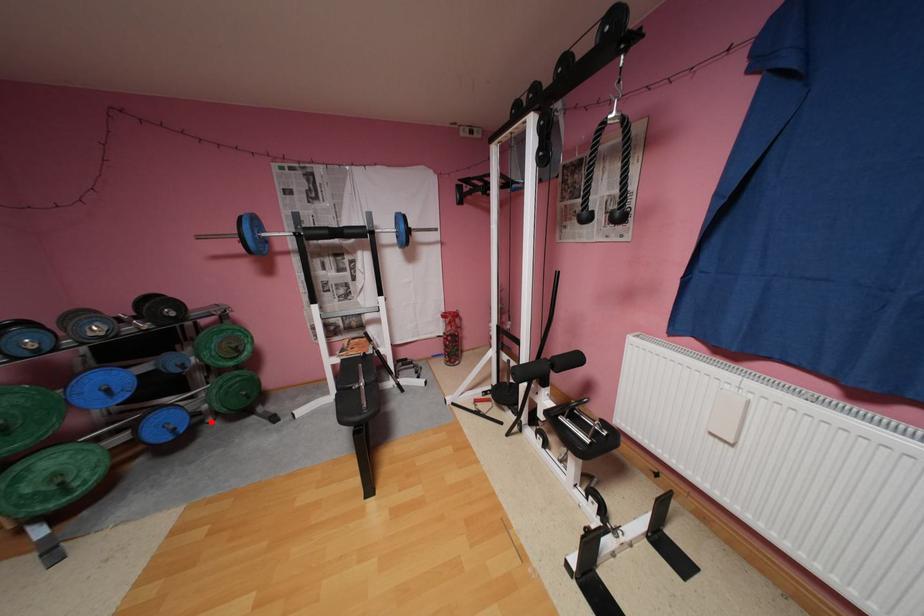
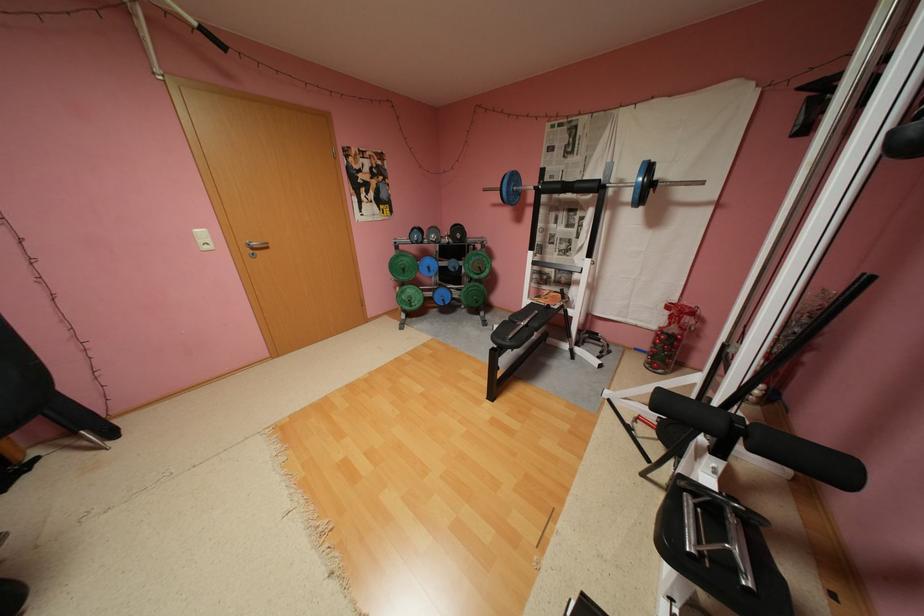
In the second image, find the point that corresponds to the highlighted location in the first image.

(468, 306)